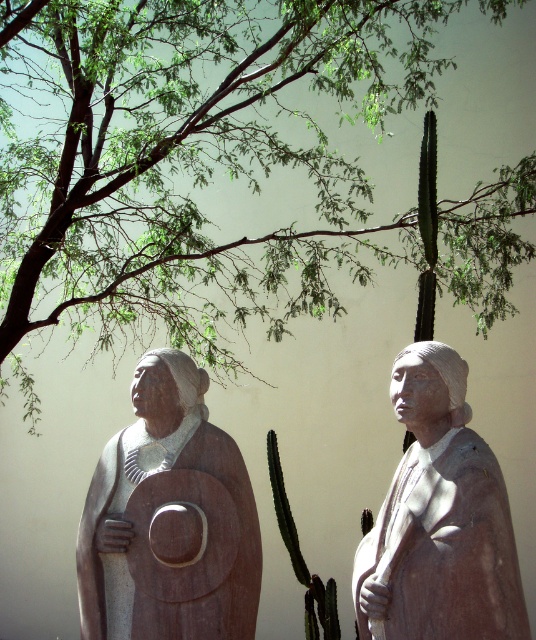
Is matte stone shield at left to the right of smooth beige statue at center from the viewer's perspective?

Incorrect, matte stone shield at left is not on the right side of smooth beige statue at center.

The width and height of the screenshot is (536, 640). What do you see at coordinates (168, 518) in the screenshot?
I see `matte stone shield at left` at bounding box center [168, 518].

You are a GUI agent. You are given a task and a screenshot of the screen. Output one action in this format:
    pyautogui.click(x=<x>, y=<y>)
    Task: Click on the matte stone shield at left
    This screenshot has height=640, width=536.
    Given the screenshot: What is the action you would take?
    pyautogui.click(x=168, y=518)

Between green leafy tree at upper left and smooth beige statue at center, which one is positioned lower?

smooth beige statue at center is below.

Is green leafy tree at upper left bigger than smooth beige statue at center?

Correct, green leafy tree at upper left is larger in size than smooth beige statue at center.

Is point (150, 202) positioned in front of point (400, 593)?

That is False.

Image resolution: width=536 pixels, height=640 pixels. I want to click on green leafy tree at upper left, so click(x=189, y=161).

Is point (274, 4) positioned in front of point (256, 598)?

No, (274, 4) is further to viewer.

Describe the element at coordinates (189, 161) in the screenshot. The width and height of the screenshot is (536, 640). I see `green leafy tree at upper left` at that location.

Where is `green leafy tree at upper left`? The image size is (536, 640). green leafy tree at upper left is located at coordinates (189, 161).